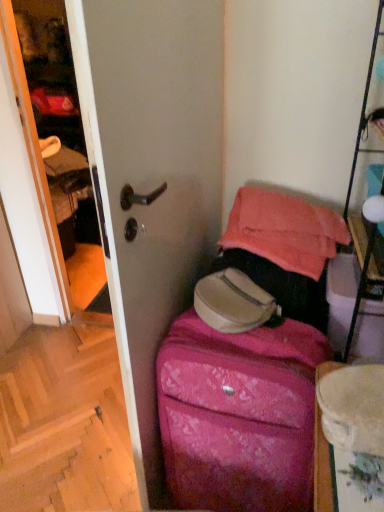
Image resolution: width=384 pixels, height=512 pixels. What are the coordinates of `free spot above wooden at lower left (from a real-world perspective)` in the screenshot? It's located at (58, 394).